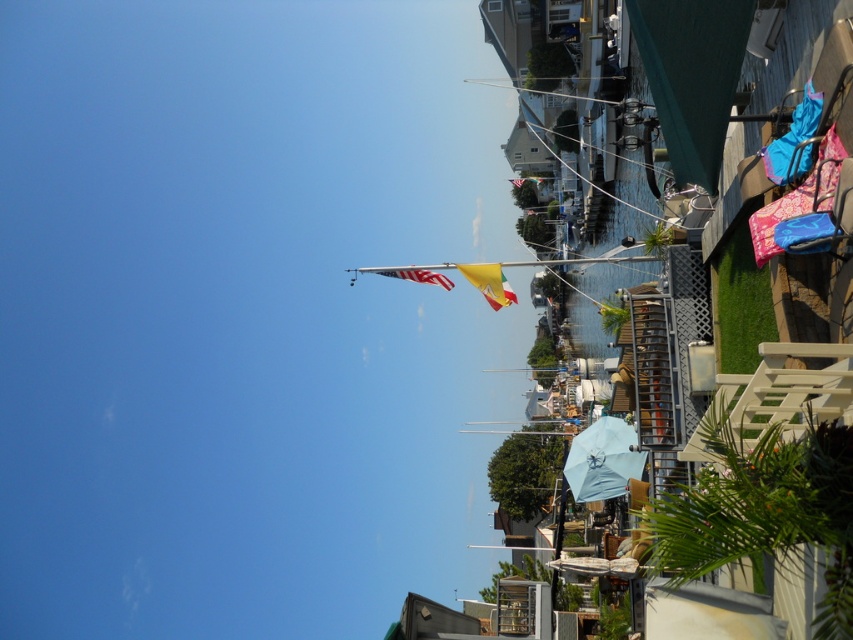
Question: Can you confirm if yellow fabric flag at center is positioned below american flag at center?

Choices:
 (A) yes
 (B) no

Answer: (A)

Question: Which point is closer to the camera?

Choices:
 (A) click(492, 296)
 (B) click(643, 452)

Answer: (A)

Question: Is the position of light blue fabric umbrella at center more distant than that of yellow fabric flag at center?

Choices:
 (A) no
 (B) yes

Answer: (B)

Question: Which point appears closest to the camera in this image?

Choices:
 (A) (611, 458)
 (B) (393, 273)

Answer: (B)

Question: Is yellow fabric flag at center wider than american flag at center?

Choices:
 (A) no
 (B) yes

Answer: (A)

Question: Which is nearer to the american flag at center?

Choices:
 (A) light blue fabric umbrella at center
 (B) yellow fabric flag at center

Answer: (B)